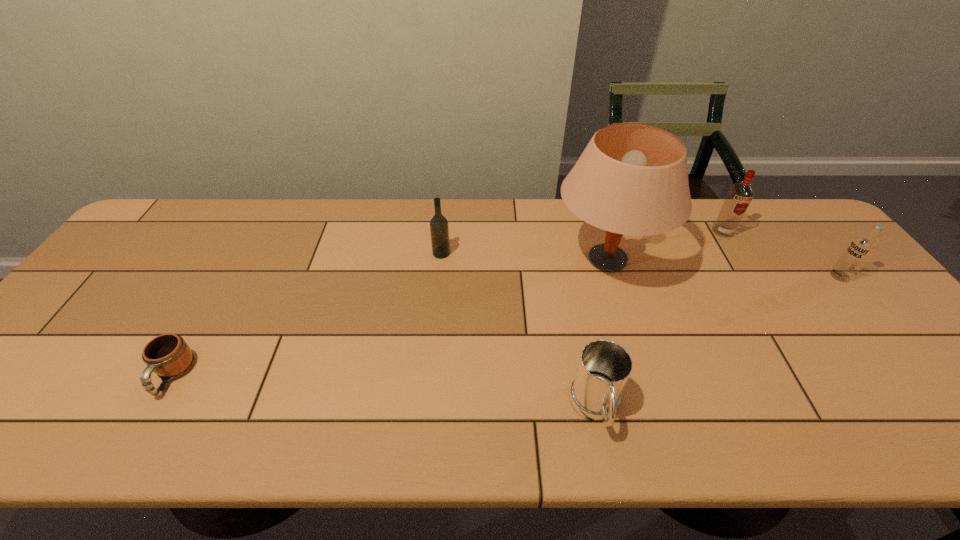
Locate an element on the screen. The width and height of the screenshot is (960, 540). free space between the fifth object from right to left and the second shortest object is located at coordinates (518, 331).

The height and width of the screenshot is (540, 960). Identify the location of vacant region between the left mug and the second vodka from left to right. (447, 303).

Locate an element on the screen. free space that is in between the second vodka from left to right and the second object from left to right is located at coordinates (582, 242).

In order to click on free space between the farthest vodka and the leftmost vodka in this screenshot , I will do `click(582, 242)`.

Locate an element on the screen. vacant area between the second vodka from left to right and the lampshade is located at coordinates (665, 246).

Find the location of a particular element. Image resolution: width=960 pixels, height=540 pixels. vacant area that lies between the fifth object from left to right and the leftmost vodka is located at coordinates (582, 242).

Locate an element on the screen. The height and width of the screenshot is (540, 960). unoccupied area between the lampshade and the left mug is located at coordinates (390, 318).

Locate an element on the screen. The width and height of the screenshot is (960, 540). free space between the nearest vodka and the shorter mug is located at coordinates coord(507,326).

The height and width of the screenshot is (540, 960). Find the location of `free space between the rightmost vodka and the fifth tallest object`. free space between the rightmost vodka and the fifth tallest object is located at coordinates tap(718, 342).

Point out which object is positioned as the second nearest to the rightmost object. Please provide its 2D coordinates. Your answer should be formatted as a tuple, i.e. [(x, y)], where the tuple contains the x and y coordinates of a point satisfying the conditions above.

[(632, 179)]